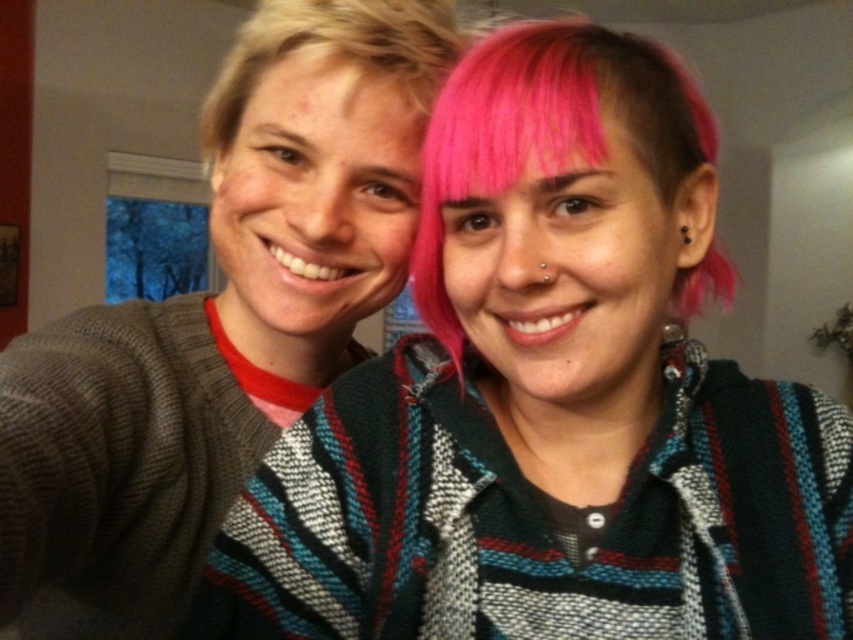
Between pink knitted sweater at center and knitted sweater at center, which one has less height?

pink knitted sweater at center

Looking at this image, which of these two, pink knitted sweater at center or knitted sweater at center, stands taller?

knitted sweater at center

Identify the location of pink knitted sweater at center. The width and height of the screenshot is (853, 640). (550, 397).

This screenshot has width=853, height=640. In order to click on pink knitted sweater at center in this screenshot , I will do `click(550, 397)`.

The height and width of the screenshot is (640, 853). Describe the element at coordinates (550, 397) in the screenshot. I see `pink knitted sweater at center` at that location.

Consider the image. Is pink knitted sweater at center smaller than blondehair at left?

No.

Between point (659, 589) and point (422, 1), which one is positioned in front?

Point (659, 589)

The height and width of the screenshot is (640, 853). I want to click on pink knitted sweater at center, so click(x=550, y=397).

Is pink knitted sweater at center positioned in front of pink dyed hair at center?

That is True.

From the picture: Is pink knitted sweater at center above pink dyed hair at center?

No.

Is point (728, 568) farther from viewer compared to point (679, 100)?

No, it is not.

Find the location of a particular element. Image resolution: width=853 pixels, height=640 pixels. pink knitted sweater at center is located at coordinates 550,397.